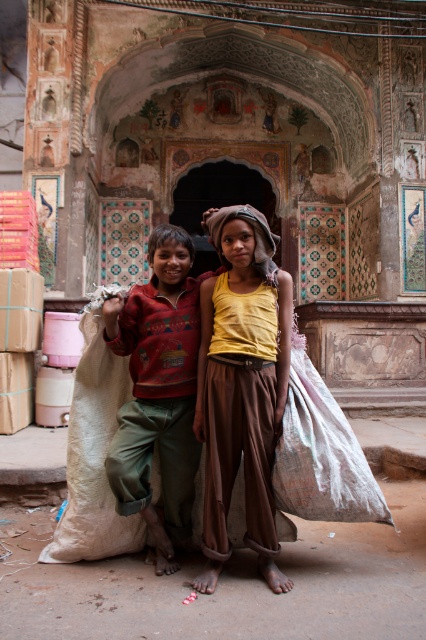
You are a tour guide explaining the historical significance of the archway to visitors. You notice the yellow cotton shirt at center and the red sweater at center in your line of sight. Which clothing item is positioned higher relative to the other?

The yellow cotton shirt at center is located above the red sweater at center, so it is positioned higher.

You are a photographer standing 10 feet away from the two people in the image. You want to capture a photo that includes both the yellow cotton shirt at center and the red sweater at center in the same frame. Given your camera has a maximum focal length that allows capturing objects up to 15 inches apart in the same shot, will you be able to include both subjects in the photo?

The distance between the yellow cotton shirt at center and the red sweater at center is 19.44 inches. Since your camera can only capture up to 15 inches in the same shot, you will not be able to include both subjects in the photo without moving closer or adjusting the focal length.

You are standing at the archway and want to take a photo of both the point at (244, 300) and the point at (163, 552). Which point should you focus on first to ensure both are in the frame?

You should focus on the point at (163, 552) first because it is further back, and by focusing on it, the point at (244, 300), which is in front, will also be in focus due to depth of field.